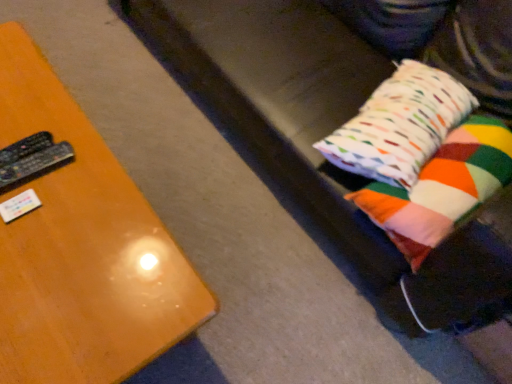
Question: Is multicolored fabric pillow at right, which is the 2th pillow in bottom-to-top order, oriented away from wooden table at left?

Choices:
 (A) no
 (B) yes

Answer: (A)

Question: Does multicolored fabric pillow at right, which is the 2th pillow in bottom-to-top order, appear on the left side of wooden table at left?

Choices:
 (A) yes
 (B) no

Answer: (B)

Question: Considering the relative sizes of multicolored fabric pillow at right, the 1th pillow from the top, and wooden table at left in the image provided, is multicolored fabric pillow at right, the 1th pillow from the top, taller than wooden table at left?

Choices:
 (A) yes
 (B) no

Answer: (B)

Question: Does multicolored fabric pillow at right, which is the 2th pillow in bottom-to-top order, have a larger size compared to wooden table at left?

Choices:
 (A) no
 (B) yes

Answer: (A)

Question: Considering the relative positions of multicolored fabric pillow at right, which is the 2th pillow in bottom-to-top order, and wooden table at left in the image provided, is multicolored fabric pillow at right, which is the 2th pillow in bottom-to-top order, to the right of wooden table at left from the viewer's perspective?

Choices:
 (A) yes
 (B) no

Answer: (A)

Question: Considering the relative sizes of multicolored fabric pillow at right, the 1th pillow from the top, and wooden table at left in the image provided, is multicolored fabric pillow at right, the 1th pillow from the top, thinner than wooden table at left?

Choices:
 (A) no
 (B) yes

Answer: (B)

Question: Is black plastic remote at left, placed as the 1th remote when sorted from top to bottom, taller than multicolored fabric pillow at right, the 1th pillow from the top?

Choices:
 (A) yes
 (B) no

Answer: (B)

Question: Are black plastic remote at left, which is the second remote in bottom-to-top order, and multicolored fabric pillow at right, which is the 2th pillow in bottom-to-top order, beside each other?

Choices:
 (A) no
 (B) yes

Answer: (A)

Question: Can you confirm if black plastic remote at left, placed as the 1th remote when sorted from top to bottom, is bigger than multicolored fabric pillow at right, which is the 2th pillow in bottom-to-top order?

Choices:
 (A) no
 (B) yes

Answer: (A)

Question: Would you say multicolored fabric pillow at right, which is the 2th pillow in bottom-to-top order, is part of black plastic remote at left, which is the second remote in bottom-to-top order,'s contents?

Choices:
 (A) yes
 (B) no

Answer: (B)

Question: From a real-world perspective, is black plastic remote at left, which is the second remote in bottom-to-top order, under multicolored fabric pillow at right, the 1th pillow from the top?

Choices:
 (A) yes
 (B) no

Answer: (A)

Question: Considering the relative sizes of black plastic remote at left, which is the second remote in bottom-to-top order, and multicolored fabric pillow at right, the 1th pillow from the top, in the image provided, is black plastic remote at left, which is the second remote in bottom-to-top order, thinner than multicolored fabric pillow at right, the 1th pillow from the top,?

Choices:
 (A) no
 (B) yes

Answer: (B)

Question: Could you tell me if black plastic remote at left, which is counted as the 1th remote, starting from the bottom, is facing black plastic remote at left, placed as the 1th remote when sorted from top to bottom?

Choices:
 (A) yes
 (B) no

Answer: (B)